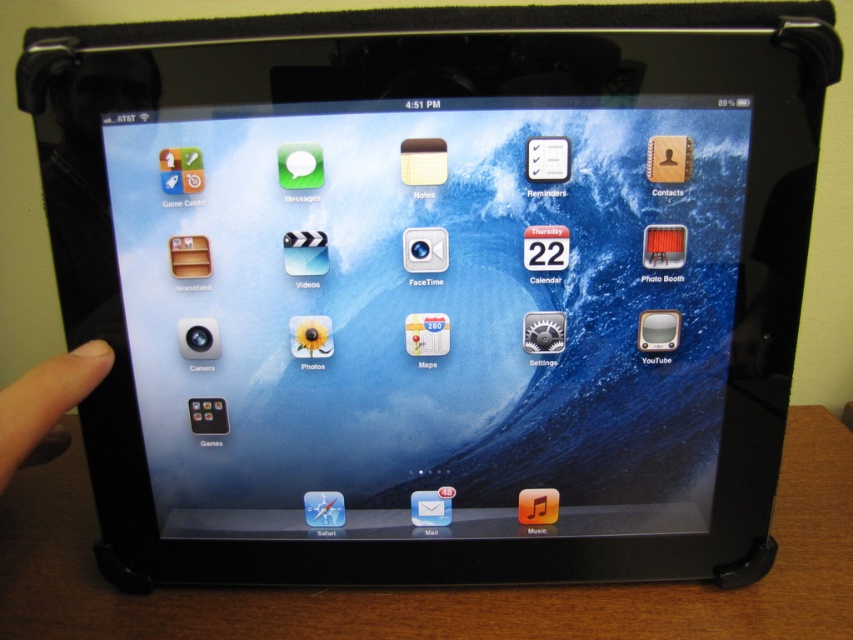
Question: From the image, what is the correct spatial relationship of brown wooden table at bottom in relation to skinsmoothhand at left?

Choices:
 (A) right
 (B) left

Answer: (A)

Question: Can you confirm if brown wooden table at bottom is smaller than skinsmoothhand at left?

Choices:
 (A) yes
 (B) no

Answer: (B)

Question: Which object appears farthest from the camera in this image?

Choices:
 (A) brown wooden table at bottom
 (B) skinsmoothhand at left

Answer: (A)

Question: Which point is closer to the camera?

Choices:
 (A) skinsmoothhand at left
 (B) brown wooden table at bottom

Answer: (A)

Question: Which point is closer to the camera taking this photo?

Choices:
 (A) (6, 392)
 (B) (838, 467)

Answer: (A)

Question: Can you confirm if brown wooden table at bottom is positioned above skinsmoothhand at left?

Choices:
 (A) yes
 (B) no

Answer: (B)